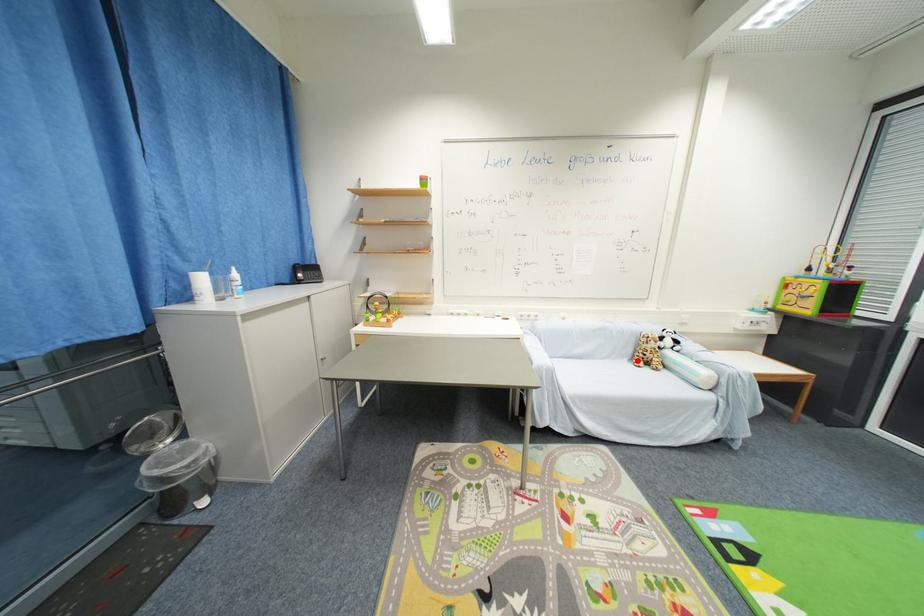
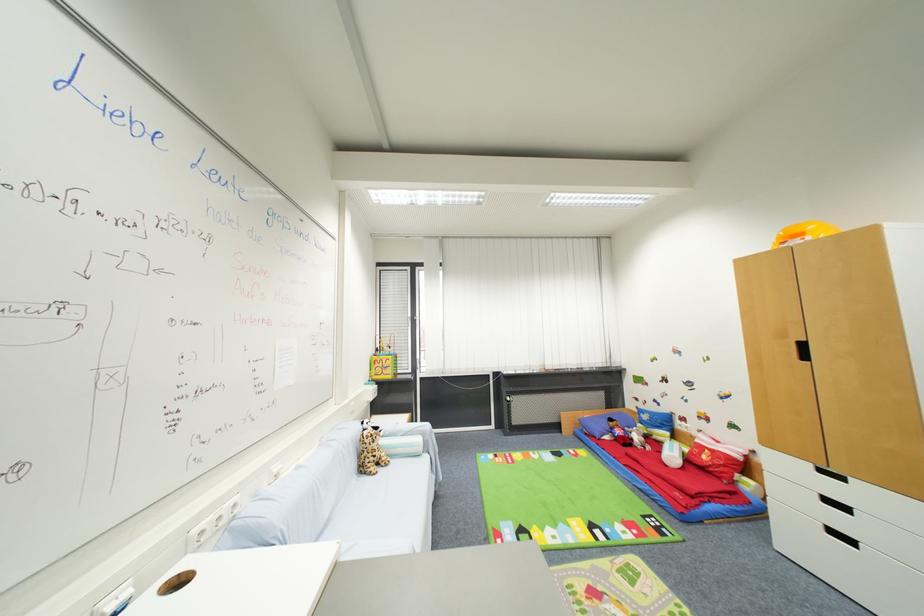
Question: I am providing you with two images of the same scene from different viewpoints. A red point is shown in image1. For the corresponding object point in image2, is it positioned nearer or farther from the camera?

Choices:
 (A) Nearer
 (B) Farther

Answer: (B)